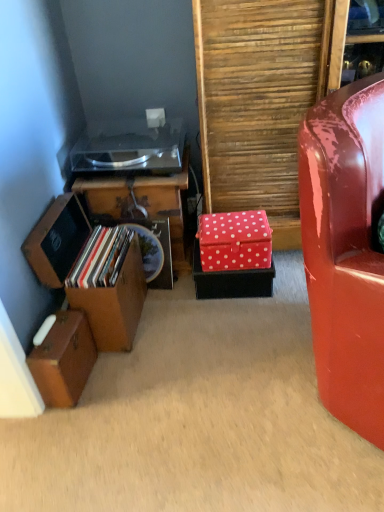
Question: Considering the positions of red polka dot fabric box at center, positioned as the 3th storage box in left-to-right order, and glossy red chair at right in the image, is red polka dot fabric box at center, positioned as the 3th storage box in left-to-right order, bigger or smaller than glossy red chair at right?

Choices:
 (A) big
 (B) small

Answer: (B)

Question: From the image's perspective, is red polka dot fabric box at center, positioned as the 3th storage box in left-to-right order, located above or below glossy red chair at right?

Choices:
 (A) below
 (B) above

Answer: (B)

Question: Based on their relative distances, which object is nearer to the red polka dot box at center right?

Choices:
 (A) wooden suitcase at lower left, marked as the first storage box in a left-to-right arrangement
 (B) glossy red chair at right
 (C) wooden cabinet at left
 (D) wooden storage box at left, the second storage box in the left-to-right sequence
 (E) red polka dot fabric box at center, which ranks as the 1th storage box in right-to-left order

Answer: (E)

Question: Which is farther from the wooden cabinet at left?

Choices:
 (A) wooden storage box at left, positioned as the second storage box in right-to-left order
 (B) wooden suitcase at lower left, placed as the third storage box when sorted from right to left
 (C) glossy red chair at right
 (D) red polka dot fabric box at center, positioned as the 3th storage box in left-to-right order
 (E) red polka dot box at center right

Answer: (C)